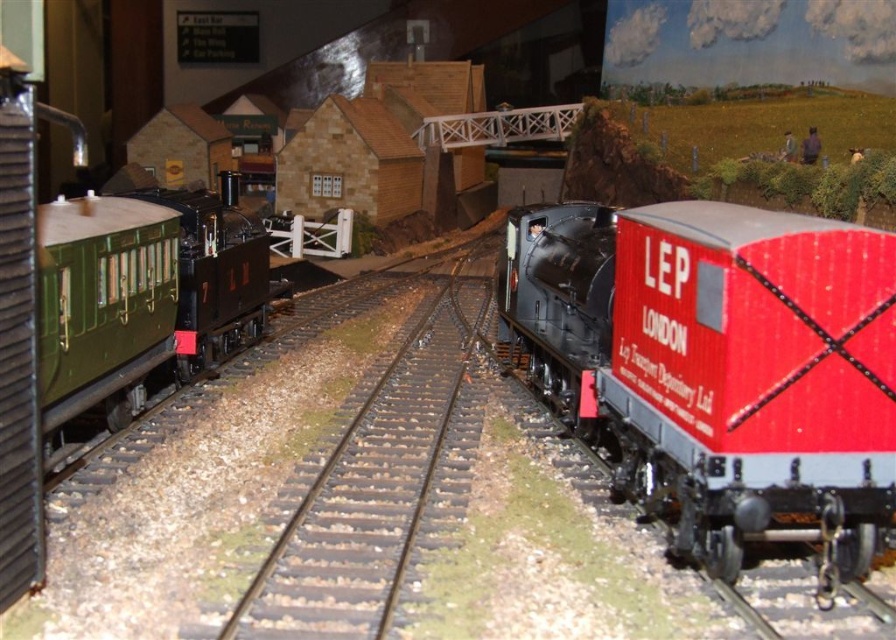
Question: Can you confirm if red glossy freight car at center is thinner than black metal train track at center?

Choices:
 (A) no
 (B) yes

Answer: (A)

Question: Which object appears farthest from the camera in this image?

Choices:
 (A) red glossy freight car at center
 (B) green polished wood passenger car at left
 (C) black metal train track at center

Answer: (B)

Question: Does red glossy freight car at center appear on the right side of black metal train track at center?

Choices:
 (A) yes
 (B) no

Answer: (A)

Question: Which is nearer to the red glossy freight car at center?

Choices:
 (A) black metal train track at center
 (B) green polished wood passenger car at left

Answer: (A)

Question: Is the position of green polished wood passenger car at left less distant than that of black metal train track at center?

Choices:
 (A) no
 (B) yes

Answer: (A)

Question: Which object appears closest to the camera in this image?

Choices:
 (A) green polished wood passenger car at left
 (B) black metal train track at center

Answer: (B)